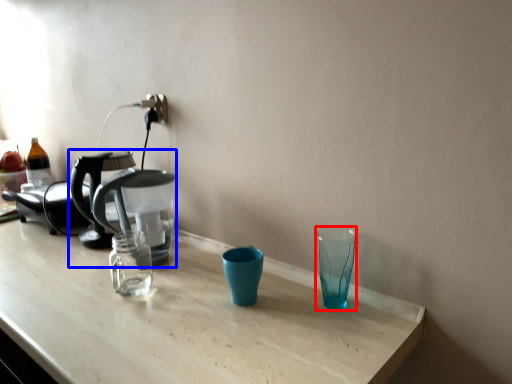
Question: Which point is further to the camera, shot glass (highlighted by a red box) or coffee maker (highlighted by a blue box)?

Choices:
 (A) shot glass
 (B) coffee maker

Answer: (B)